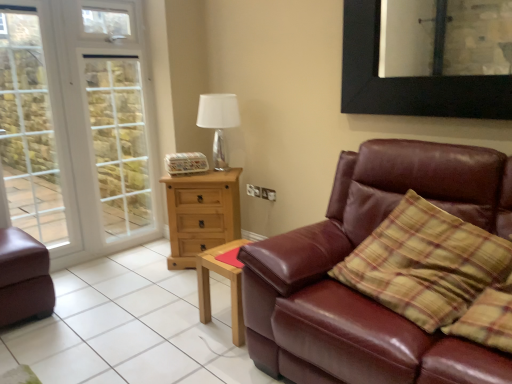
Identify the location of free space to the left of light brown wooden chest of drawers at center. (145, 261).